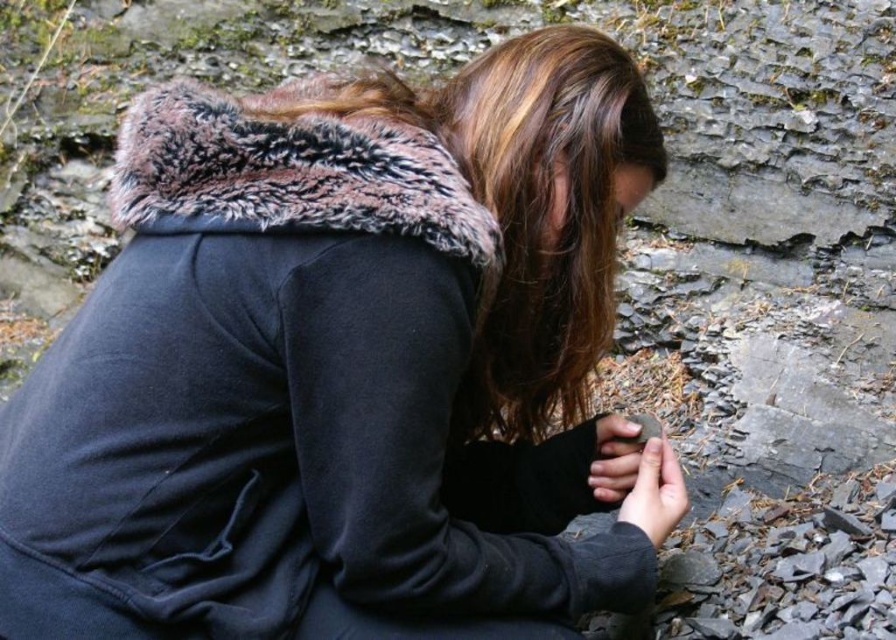
Question: Which is nearer to the black fleece jacket at center?

Choices:
 (A) brown matte hair at center
 (B) smooth gray stone at lower center
 (C) smooth brown stone at lower center

Answer: (A)

Question: Is brown matte hair at center above smooth gray stone at lower center?

Choices:
 (A) no
 (B) yes

Answer: (B)

Question: Does brown matte hair at center have a larger size compared to smooth gray stone at lower center?

Choices:
 (A) yes
 (B) no

Answer: (A)

Question: Does smooth brown stone at lower center have a lesser width compared to smooth gray stone at lower center?

Choices:
 (A) yes
 (B) no

Answer: (B)

Question: Which point is farther to the camera?

Choices:
 (A) (588, 184)
 (B) (599, 451)

Answer: (B)

Question: Among these objects, which one is nearest to the camera?

Choices:
 (A) smooth gray stone at lower center
 (B) brown matte hair at center

Answer: (B)